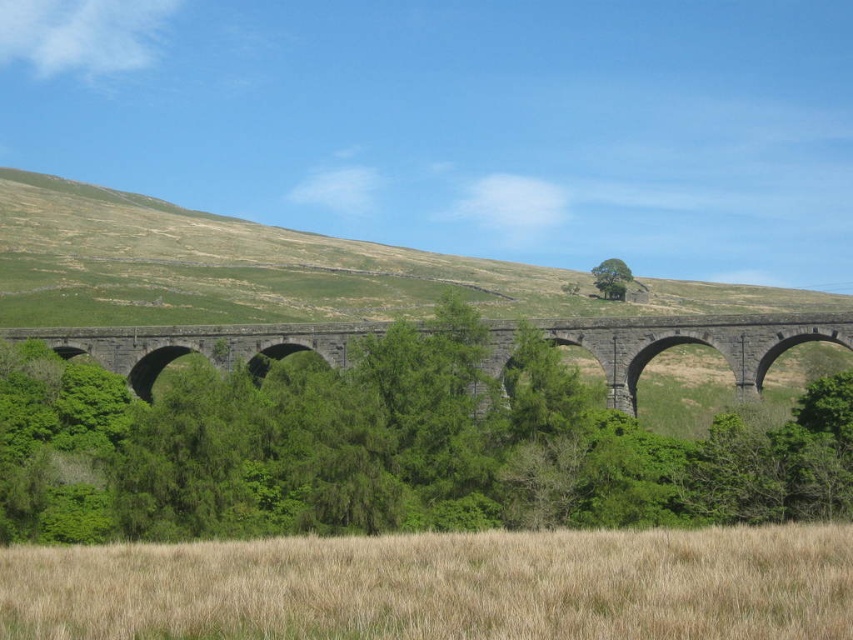
You are a landscape architect planning to plant a new row of shrubs between the dry grass at lower center and the green leafy tree at center. The shrubs require a minimum of 100 meters of space to grow properly. Based on the scene, will there be enough space for them?

The distance between the dry grass at lower center and the green leafy tree at center is 95.94 meters. Since the shrubs require a minimum of 100 meters, there is insufficient space for them to grow properly.

You are a landscape architect evaluating the scene. You need to determine which area, the dry grass at lower center or the green grassy hillside at upper center, requires more immediate attention for soil moisture. Based on the scene description, which area should you prioritize?

The dry grass at lower center has a smaller size compared to the green grassy hillside at upper center, but the dryness indicates it needs more immediate attention for soil moisture.